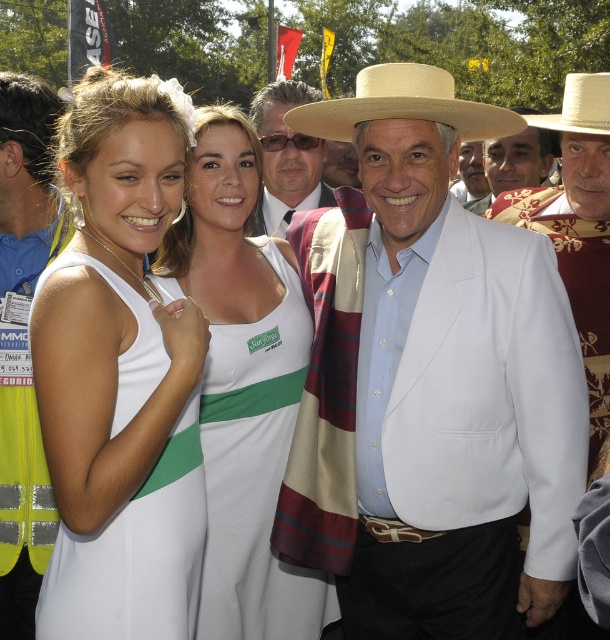
You are a photographer trying to capture both the natural straw cowboy hat at center and the white cotton hat at center in a single shot. Which hat will appear taller in the photo?

The white cotton hat at center will appear taller in the photo because the natural straw cowboy hat at center is not as tall as it.